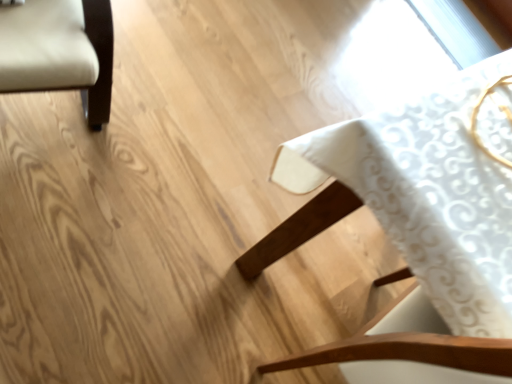
Describe the element at coordinates (422, 193) in the screenshot. The width and height of the screenshot is (512, 384). I see `wooden chair at upper right` at that location.

This screenshot has height=384, width=512. I want to click on wooden chair at upper right, so click(x=422, y=193).

You are a GUI agent. You are given a task and a screenshot of the screen. Output one action in this format:
    pyautogui.click(x=<x>, y=<y>)
    Task: Click on the wooden chair at upper right
    
    Given the screenshot: What is the action you would take?
    pyautogui.click(x=422, y=193)